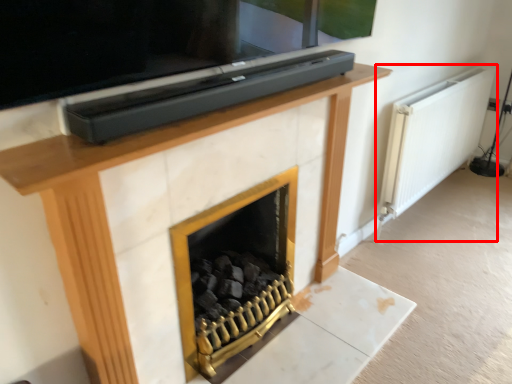
Question: In this image, where is radiator (annotated by the red box) located relative to fireplace?

Choices:
 (A) left
 (B) right

Answer: (B)